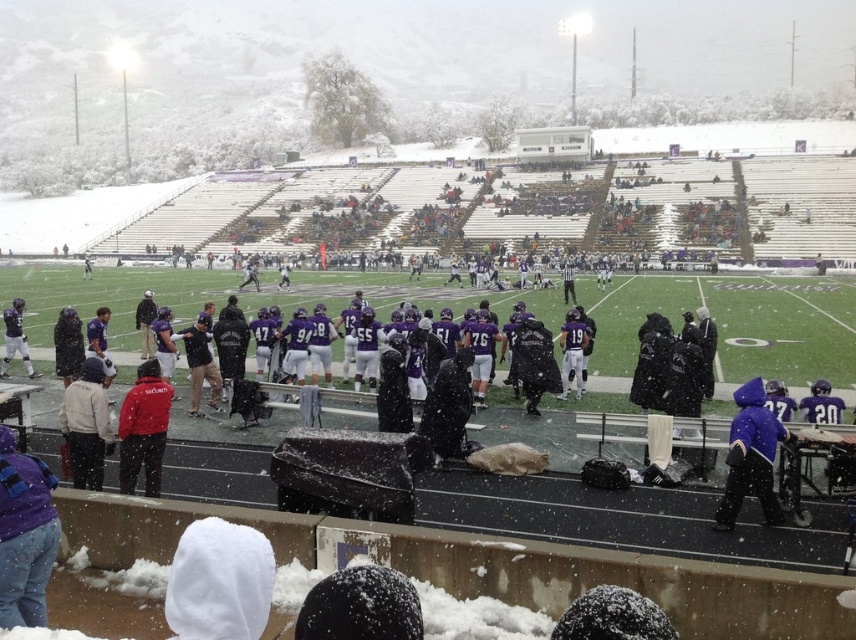
Question: Estimate the real-world distances between objects in this image. Which object is farther from the white fleece jacket at lower left?

Choices:
 (A) matte purple jersey at center
 (B) purple fleece jacket at lower left

Answer: (A)

Question: Is purple fleece jacket at lower left above red matte jacket at center?

Choices:
 (A) yes
 (B) no

Answer: (B)

Question: Which point is farther to the camera?

Choices:
 (A) black matte jacket at left
 (B) white fleece jacket at lower left
 (C) matte purple jersey at left
 (D) purple fleece jacket at lower left

Answer: (C)

Question: Is purple matte jacket at lower right further to camera compared to black matte jacket at left?

Choices:
 (A) no
 (B) yes

Answer: (A)

Question: Which object is farther from the camera taking this photo?

Choices:
 (A) red matte jacket at center
 (B) black matte jacket at left

Answer: (B)

Question: Does white fleece jacket at lower left have a lesser width compared to black matte jacket at left?

Choices:
 (A) yes
 (B) no

Answer: (A)